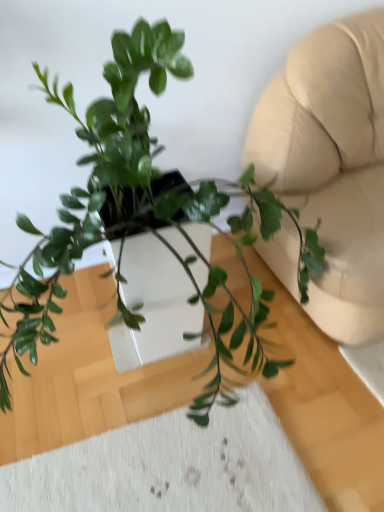
Identify the location of vacant space in green glossy plant at center (from a real-world perspective). (141, 385).